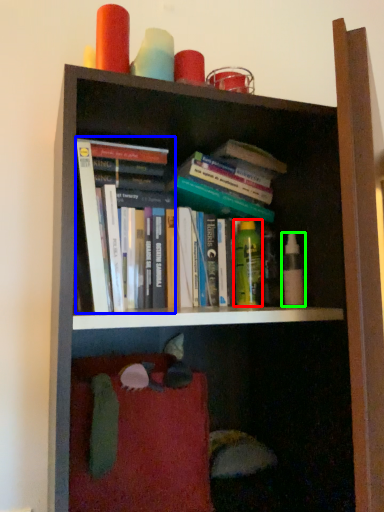
Question: Considering the real-world distances, which object is farthest from toiletry (highlighted by a red box)? book (highlighted by a blue box) or toiletry (highlighted by a green box)?

Choices:
 (A) book
 (B) toiletry

Answer: (A)